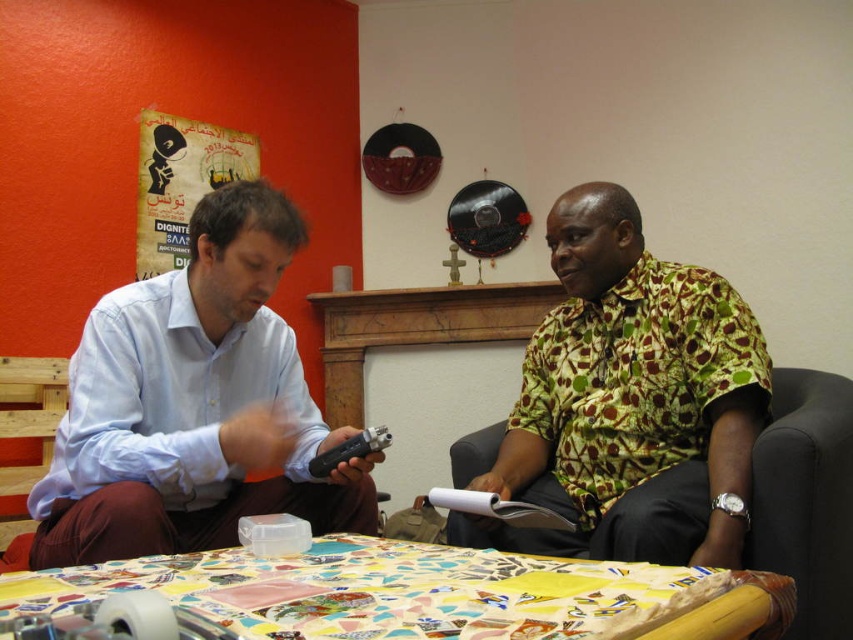
You are a photographer standing at the point marked as point (111, 417). You want to take a photo of both individuals so that they are both in focus. The camera you are using has a depth of field that can cover a distance of 1.2 meters. Will you be able to capture both individuals clearly in the same photo?

The two individuals are 1.34 meters apart, which exceeds the camera depth of field of 1.2 meters. Therefore, you cannot capture both clearly in focus in the same photo.

You are a photographer standing 10 feet away from the two individuals in the scene. You want to capture a photo of both the green patterned shirt at center and the light blue shirt at left in a single frame. Given that your camera has a maximum focus range of 9 feet, will you be able to take the photo without moving closer?

The photographer is 10 feet away from both individuals, which exceeds the camera maximum focus range of 9 feet. Therefore, the photographer cannot capture both the green patterned shirt at center and the light blue shirt at left in a single frame without moving closer.

You are organizing a photo shoot and need to ensure that the green patterned shirt at center and the light blue shirt at left are visible in the frame. Which shirt should you focus on to ensure both are in the frame?

The green patterned shirt at center is bigger than the light blue shirt at left, so focusing on the larger green patterned shirt at center will help ensure both shirts are visible in the frame.